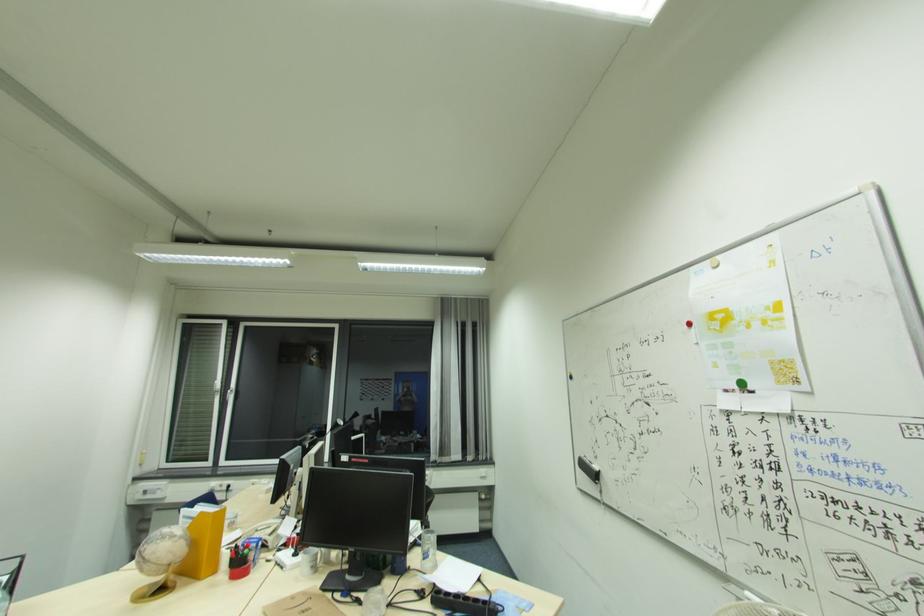
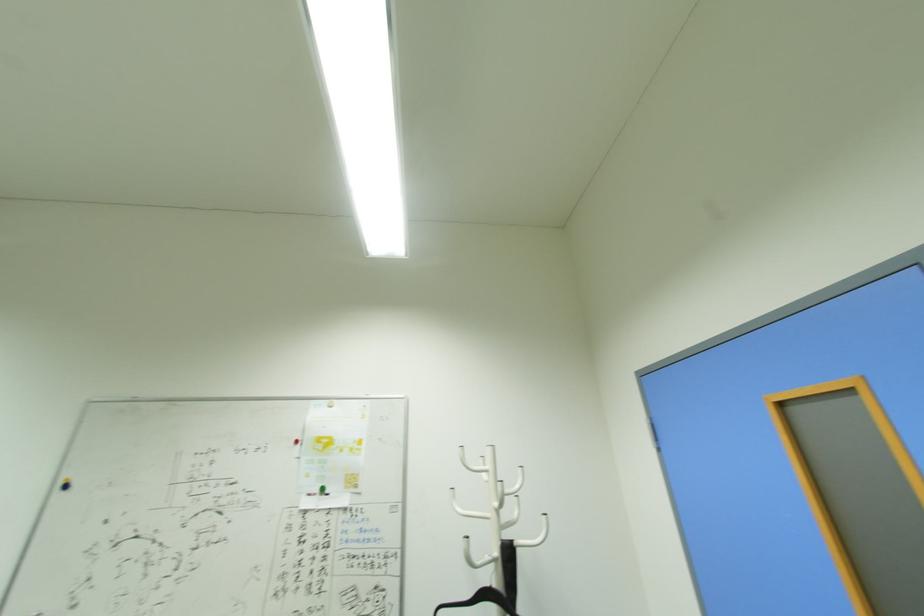
First-person continuous shooting, in which direction is the camera rotating?

The camera's rotation is toward right-up.